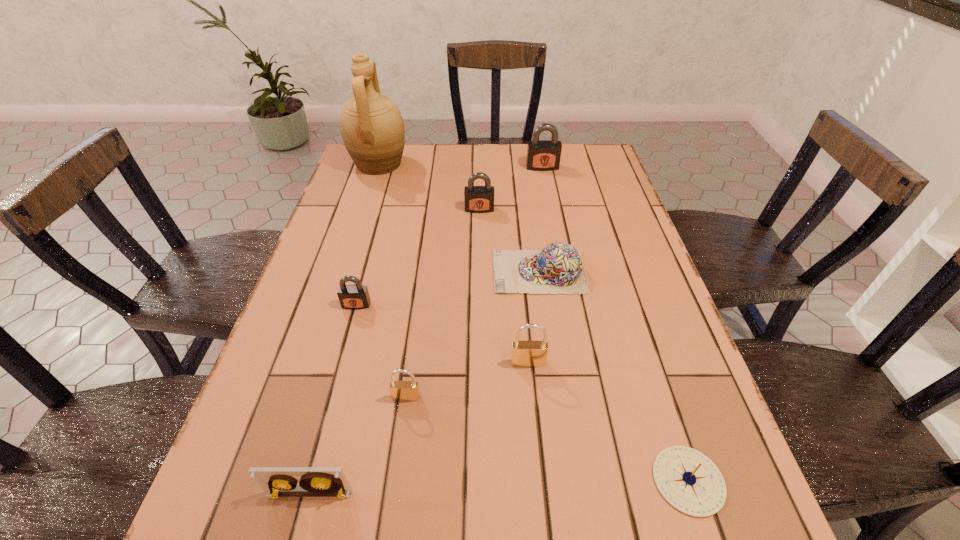
At what (x,y) coordinates should I click in order to perform the action: click on the tallest object. Please return your answer as a coordinate pair (x, y). Image resolution: width=960 pixels, height=540 pixels. Looking at the image, I should click on (372, 128).

What are the coordinates of `the tallest padlock` in the screenshot? It's located at (542, 155).

The width and height of the screenshot is (960, 540). What are the coordinates of `the farthest gray padlock` in the screenshot? It's located at (542, 155).

Locate an element on the screen. The image size is (960, 540). the third farthest object is located at coordinates (478, 199).

Identify the location of the second biggest gray padlock. (478, 199).

Find the location of a particular element. the bigger brass padlock is located at coordinates (529, 353).

Identify the location of the second padlock from right to left. (529, 353).

At what (x,y) coordinates should I click in order to perform the action: click on the leftmost gray padlock. Please return your answer as a coordinate pair (x, y). This screenshot has width=960, height=540. Looking at the image, I should click on (354, 297).

The width and height of the screenshot is (960, 540). Identify the location of the nearest gray padlock. (354, 297).

The width and height of the screenshot is (960, 540). What are the coordinates of `the seventh farthest object` in the screenshot? It's located at (400, 390).